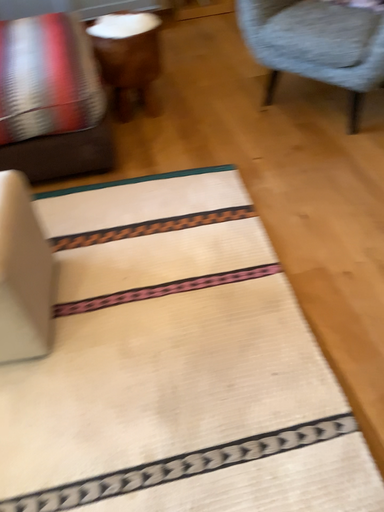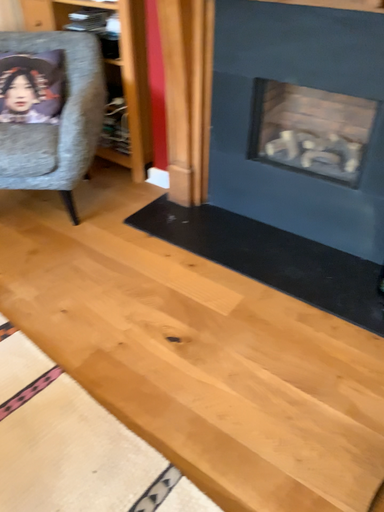
Question: Which way did the camera rotate in the video?

Choices:
 (A) rotated left
 (B) rotated right

Answer: (B)